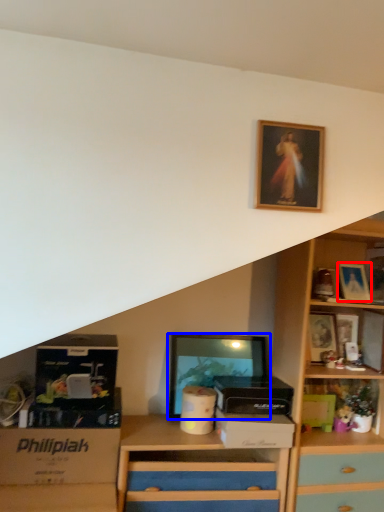
Question: Among these objects, which one is nearest to the camera, picture frame (highlighted by a red box) or picture frame (highlighted by a blue box)?

Choices:
 (A) picture frame
 (B) picture frame

Answer: (B)